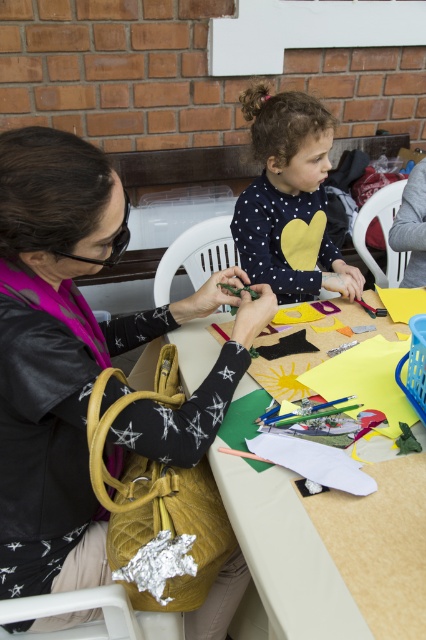
Question: Which object is farther from the camera taking this photo?

Choices:
 (A) matte brown table at center
 (B) quilted yellow purse at center
 (C) polka dot sweater at center

Answer: (C)

Question: Estimate the real-world distances between objects in this image. Which object is farther from the polka dot sweater at center?

Choices:
 (A) quilted yellow purse at center
 (B) matte brown table at center

Answer: (B)

Question: Does matte brown table at center appear on the left side of polka dot sweater at center?

Choices:
 (A) no
 (B) yes

Answer: (B)

Question: Does quilted yellow purse at center appear under matte brown table at center?

Choices:
 (A) yes
 (B) no

Answer: (B)

Question: Which is farther from the matte brown table at center?

Choices:
 (A) quilted yellow purse at center
 (B) polka dot sweater at center

Answer: (B)

Question: Observing the image, what is the correct spatial positioning of quilted yellow purse at center in reference to polka dot sweater at center?

Choices:
 (A) left
 (B) right

Answer: (A)